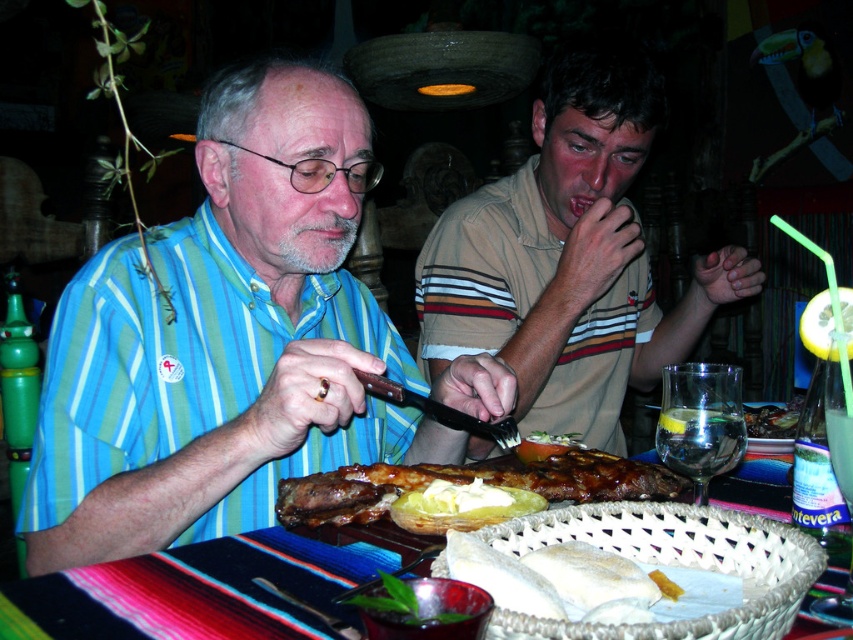
You are a customer sitting at the wooden table at center. You want to reach for the yellow buttery potato at center. Is it within your immediate reach from your current position?

The wooden table at center is closer to the viewer than yellow buttery potato at center, so the potato is farther away. Since you are sitting at the table, the potato might still be within reach depending on its placement, but based on the description, it is positioned farther from you than the table itself.

From the picture: You are a waiter at the restaurant and need to place a new order on the wooden table at center. However, there is a blue striped shirt at center on top of it. What should you do first?

The blue striped shirt at center is above the wooden table at center, so you should remove the blue striped shirt at center from the wooden table at center before placing the new order.

You are a food critic who just arrived at the restaurant and see the white doughy bread at center and the yellow buttery potato at center on the table. Which item is taller?

The white doughy bread at center is taller than the yellow buttery potato at center.